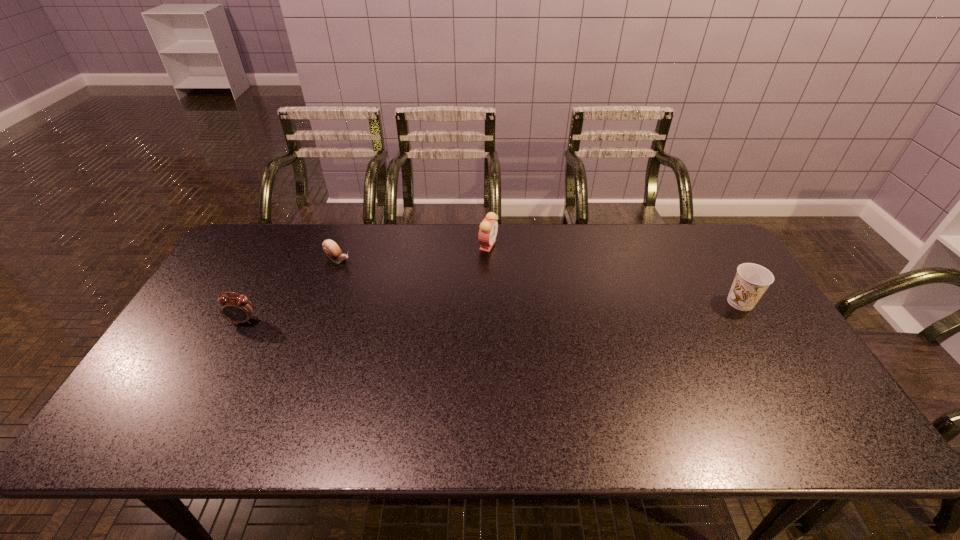
You are a GUI agent. You are given a task and a screenshot of the screen. Output one action in this format:
    pyautogui.click(x=<x>, y=<y>)
    Task: Click on the vacant space located 0.080m on the face of the farther alarm clock
    
    Given the screenshot: What is the action you would take?
    tap(506, 266)

Identify the location of vacant space located on the face of the farther alarm clock. Image resolution: width=960 pixels, height=540 pixels. (566, 333).

At what (x,y) coordinates should I click in order to perform the action: click on vacant space located on the face of the farther alarm clock. Please return your answer as a coordinate pair (x, y). The image size is (960, 540). Looking at the image, I should click on (532, 295).

Image resolution: width=960 pixels, height=540 pixels. What are the coordinates of `vacant space located on the front-facing side of the third object from right to left` in the screenshot? It's located at (420, 301).

Where is `vacant space located on the front-facing side of the third object from right to left`? vacant space located on the front-facing side of the third object from right to left is located at coordinates (400, 290).

Image resolution: width=960 pixels, height=540 pixels. I want to click on blank space located on the front-facing side of the third object from right to left, so click(x=408, y=294).

The width and height of the screenshot is (960, 540). Identify the location of alarm clock positioned at the far edge. (x=488, y=229).

Find the location of a particular element. escargot that is at the far edge is located at coordinates (331, 249).

Find the location of a particular element. object positioned at the left edge is located at coordinates (238, 309).

Locate an element on the screen. object present at the right edge is located at coordinates (751, 281).